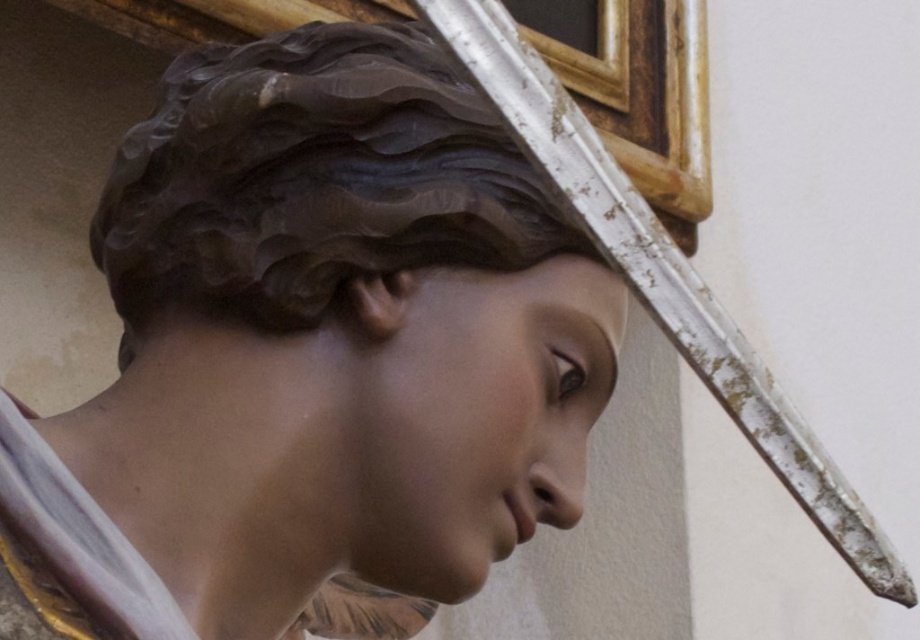
You are an art conservator examining the sculpture. You need to determine if the matte brown statue at center can be placed on a display stand designed for objects wider than the white weathered wood cross at upper center. Can it fit?

The matte brown statue at center is wider than the white weathered wood cross at upper center, so it can fit on the display stand designed for objects wider than the white weathered wood cross at upper center.

You are an art conservator standing 1.5 meters away from the matte brown statue at center. Can you reach the statue to clean it without moving closer?

The matte brown statue at center is 1.20 meters from the viewer, so you are standing 1.5 meters away. Since you are farther away than the statue, you cannot reach it without moving closer.